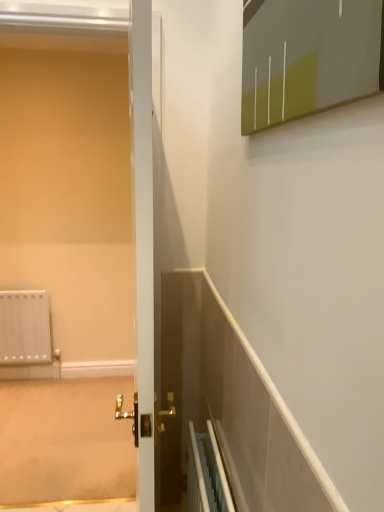
Question: Is matte gray medicine cabinet at upper right spatially inside matte white screen door at left, or outside of it?

Choices:
 (A) inside
 (B) outside

Answer: (B)

Question: Considering the positions of matte gray medicine cabinet at upper right and matte white screen door at left in the image, is matte gray medicine cabinet at upper right wider or thinner than matte white screen door at left?

Choices:
 (A) thin
 (B) wide

Answer: (A)

Question: Based on their sizes in the image, would you say matte gray medicine cabinet at upper right is bigger or smaller than matte white screen door at left?

Choices:
 (A) small
 (B) big

Answer: (A)

Question: In the image, is matte white screen door at left on the left side or the right side of matte gray medicine cabinet at upper right?

Choices:
 (A) left
 (B) right

Answer: (A)

Question: Is matte white screen door at left in front of or behind matte gray medicine cabinet at upper right in the image?

Choices:
 (A) behind
 (B) front

Answer: (A)

Question: Is matte white screen door at left inside or outside of matte gray medicine cabinet at upper right?

Choices:
 (A) inside
 (B) outside

Answer: (B)

Question: In terms of height, does matte white screen door at left look taller or shorter compared to matte gray medicine cabinet at upper right?

Choices:
 (A) tall
 (B) short

Answer: (A)